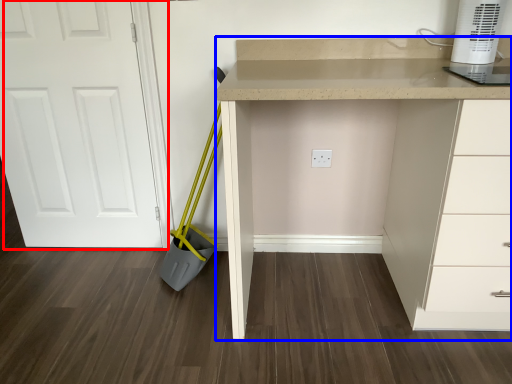
Question: Which object appears closest to the camera in this image, door (highlighted by a red box) or computer desk (highlighted by a blue box)?

Choices:
 (A) door
 (B) computer desk

Answer: (B)